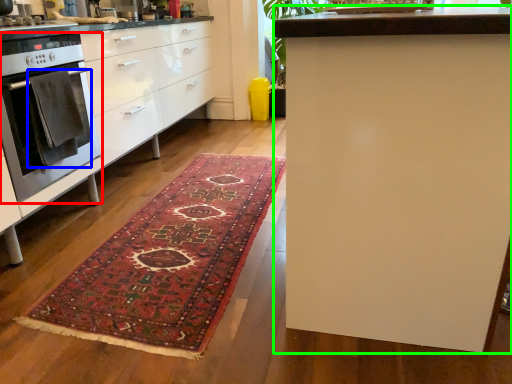
Question: Considering the real-world distances, which object is farthest from home appliance (highlighted by a red box)? blanket (highlighted by a blue box) or table (highlighted by a green box)?

Choices:
 (A) blanket
 (B) table

Answer: (B)